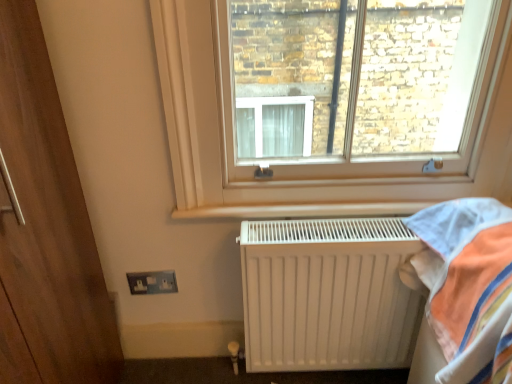
What do you see at coordinates (152, 282) in the screenshot? Image resolution: width=512 pixels, height=384 pixels. I see `metallic silver electrical outlet at lower left` at bounding box center [152, 282].

Describe the element at coordinates (327, 294) in the screenshot. This screenshot has width=512, height=384. I see `white matte radiator at lower right` at that location.

I want to click on white plastic window at upper center, so click(x=306, y=162).

The width and height of the screenshot is (512, 384). Identify the location of metallic silver electrical outlet at lower left. (152, 282).

Looking at the image, does metallic silver electrical outlet at lower left seem bigger or smaller compared to white plastic window at upper center?

Considering their sizes, metallic silver electrical outlet at lower left takes up less space than white plastic window at upper center.

Is white plastic window at upper center a part of metallic silver electrical outlet at lower left?

No.

Is metallic silver electrical outlet at lower left closer to camera compared to white plastic window at upper center?

No, metallic silver electrical outlet at lower left is further to the viewer.

Is point (298, 366) less distant than point (222, 210)?

No, (298, 366) is further to viewer.

Is white matte radiator at lower right taller or shorter than white plastic window at upper center?

Clearly, white matte radiator at lower right is shorter compared to white plastic window at upper center.

From a real-world perspective, which object stands above the other?

white plastic window at upper center.

Is white matte radiator at lower right behind white plastic window at upper center?

That is True.

What's the angular difference between white plastic window at upper center and metallic silver electrical outlet at lower left's facing directions?

0.267 degrees separate the facing orientations of white plastic window at upper center and metallic silver electrical outlet at lower left.

Considering the positions of objects white plastic window at upper center and metallic silver electrical outlet at lower left in the image provided, who is in front, white plastic window at upper center or metallic silver electrical outlet at lower left?

white plastic window at upper center is more forward.

Is white plastic window at upper center wider or thinner than metallic silver electrical outlet at lower left?

Considering their sizes, white plastic window at upper center looks broader than metallic silver electrical outlet at lower left.

From a real-world perspective, is white plastic window at upper center located higher than metallic silver electrical outlet at lower left?

Yes, from a real-world perspective, white plastic window at upper center is on top of metallic silver electrical outlet at lower left.

What's the angular difference between metallic silver electrical outlet at lower left and white matte radiator at lower right's facing directions?

0.0551 degrees separate the facing orientations of metallic silver electrical outlet at lower left and white matte radiator at lower right.

Does metallic silver electrical outlet at lower left lie in front of white matte radiator at lower right?

That is False.

Is metallic silver electrical outlet at lower left facing towards white matte radiator at lower right?

No.

From the picture: Does white matte radiator at lower right have a lesser height compared to metallic silver electrical outlet at lower left?

Incorrect, the height of white matte radiator at lower right does not fall short of that of metallic silver electrical outlet at lower left.

Is white matte radiator at lower right aimed at metallic silver electrical outlet at lower left?

No, white matte radiator at lower right is not turned towards metallic silver electrical outlet at lower left.

Where is `radiator that is below the metallic silver electrical outlet at lower left (from the image's perspective)`? Image resolution: width=512 pixels, height=384 pixels. radiator that is below the metallic silver electrical outlet at lower left (from the image's perspective) is located at coordinates (327, 294).

Can we say white matte radiator at lower right lies outside metallic silver electrical outlet at lower left?

Yes, white matte radiator at lower right is not within metallic silver electrical outlet at lower left.

Is white plastic window at upper center not inside white matte radiator at lower right?

Absolutely, white plastic window at upper center is external to white matte radiator at lower right.

What's the angular difference between white plastic window at upper center and white matte radiator at lower right's facing directions?

0.219 degrees separate the facing orientations of white plastic window at upper center and white matte radiator at lower right.

From the image's perspective, is white plastic window at upper center positioned above or below white matte radiator at lower right?

Clearly, from the image's perspective, white plastic window at upper center is above white matte radiator at lower right.

From a real-world perspective, does white plastic window at upper center sit lower than white matte radiator at lower right?

No.

The width and height of the screenshot is (512, 384). I want to click on window above the metallic silver electrical outlet at lower left (from a real-world perspective), so click(x=306, y=162).

I want to click on radiator that appears behind the white plastic window at upper center, so click(327, 294).

Which object lies further to the anchor point metallic silver electrical outlet at lower left, white plastic window at upper center or white matte radiator at lower right?

white plastic window at upper center lies further to metallic silver electrical outlet at lower left than the other object.

When comparing their distances from white matte radiator at lower right, does metallic silver electrical outlet at lower left or white plastic window at upper center seem further?

metallic silver electrical outlet at lower left is positioned further to the anchor white matte radiator at lower right.

Which object lies nearer to the anchor point white matte radiator at lower right, white plastic window at upper center or metallic silver electrical outlet at lower left?

white plastic window at upper center is closer to white matte radiator at lower right.

Based on their spatial positions, is metallic silver electrical outlet at lower left or white matte radiator at lower right further from white plastic window at upper center?

Based on the image, metallic silver electrical outlet at lower left appears to be further to white plastic window at upper center.

Based on their spatial positions, is white matte radiator at lower right or white plastic window at upper center closer to metallic silver electrical outlet at lower left?

The object closer to metallic silver electrical outlet at lower left is white matte radiator at lower right.

Based on their spatial positions, is white matte radiator at lower right or metallic silver electrical outlet at lower left further from white plastic window at upper center?

Among the two, metallic silver electrical outlet at lower left is located further to white plastic window at upper center.

Identify the location of radiator between metallic silver electrical outlet at lower left and white plastic window at upper center from left to right. Image resolution: width=512 pixels, height=384 pixels. (327, 294).